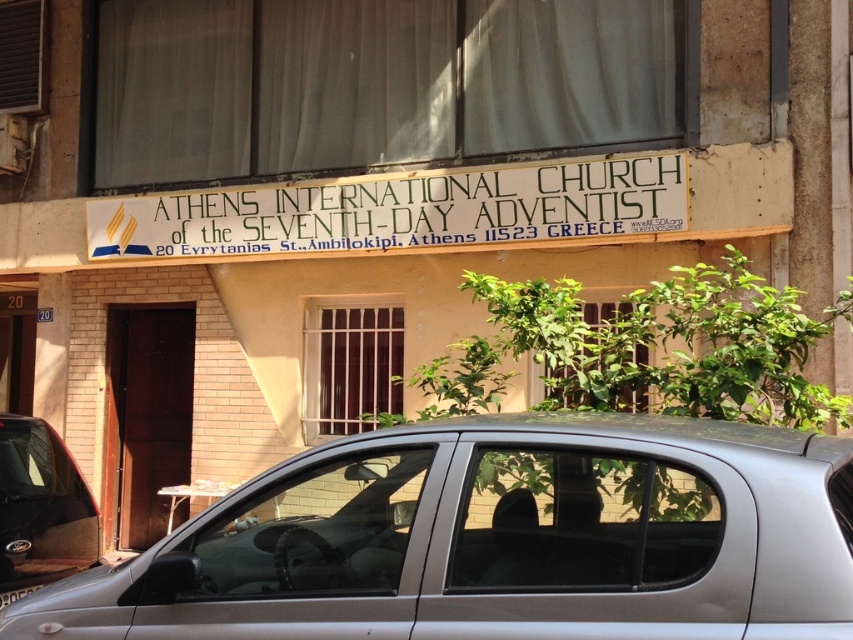
Between satin silver car at center and metallic gray car at lower left, which one is positioned higher?

satin silver car at center is above.

Identify the location of satin silver car at center. The width and height of the screenshot is (853, 640). (497, 540).

The image size is (853, 640). What are the coordinates of `satin silver car at center` in the screenshot? It's located at (497, 540).

The width and height of the screenshot is (853, 640). Describe the element at coordinates (497, 540) in the screenshot. I see `satin silver car at center` at that location.

Does satin silver car at center appear under white painted wood sign at upper center?

Correct, satin silver car at center is located below white painted wood sign at upper center.

Which is in front, point (766, 632) or point (448, 225)?

Point (766, 632) is more forward.

The width and height of the screenshot is (853, 640). Identify the location of satin silver car at center. (497, 540).

Does satin silver car at center appear on the left side of white sheer curtain at upper center?

Incorrect, satin silver car at center is not on the left side of white sheer curtain at upper center.

Can you confirm if satin silver car at center is wider than white sheer curtain at upper center?

Incorrect, satin silver car at center's width does not surpass white sheer curtain at upper center's.

Locate an element on the screen. Image resolution: width=853 pixels, height=640 pixels. satin silver car at center is located at coordinates (497, 540).